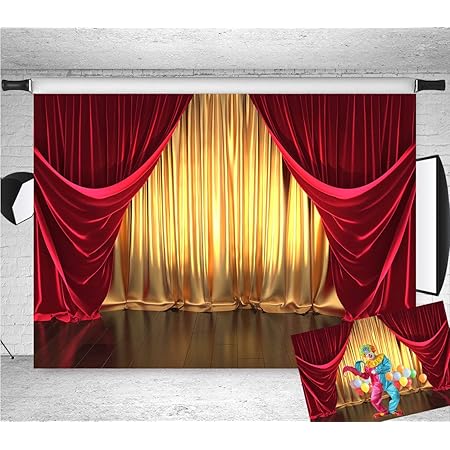
The width and height of the screenshot is (450, 450). What are the coordinates of `painted brick wall` in the screenshot? It's located at (15, 131), (433, 124).